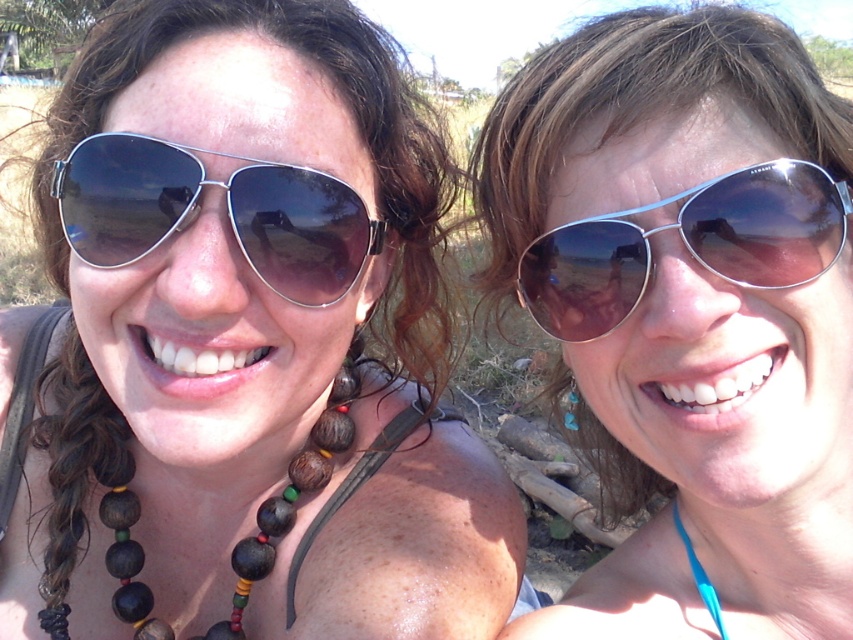
Question: Is metal aviator sunglasses at left closer to camera compared to metal aviator sunglasses at right?

Choices:
 (A) yes
 (B) no

Answer: (B)

Question: Which object appears farthest from the camera in this image?

Choices:
 (A) metallic aviator sunglasses at center
 (B) wooden beads at left
 (C) metal aviator sunglasses at left

Answer: (B)

Question: Which object is closer to the camera taking this photo?

Choices:
 (A) metal aviator sunglasses at left
 (B) wooden beads at left
 (C) metallic aviator sunglasses at center

Answer: (C)

Question: Is metal aviator sunglasses at right thinner than wooden beads at left?

Choices:
 (A) yes
 (B) no

Answer: (A)

Question: Is metal aviator sunglasses at left positioned at the back of wooden beads at left?

Choices:
 (A) no
 (B) yes

Answer: (A)

Question: Which of these objects is positioned closest to the metal aviator sunglasses at right?

Choices:
 (A) metal aviator sunglasses at left
 (B) wooden beads at left
 (C) matte black sunglasses at upper left
 (D) metallic aviator sunglasses at center

Answer: (D)